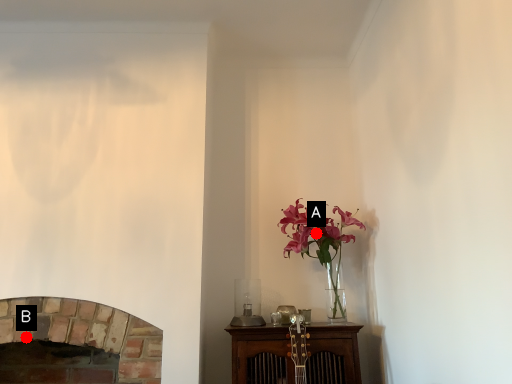
Question: Two points are circled on the image, labeled by A and B beside each circle. Which point is closer to the camera?

Choices:
 (A) A is closer
 (B) B is closer

Answer: (B)